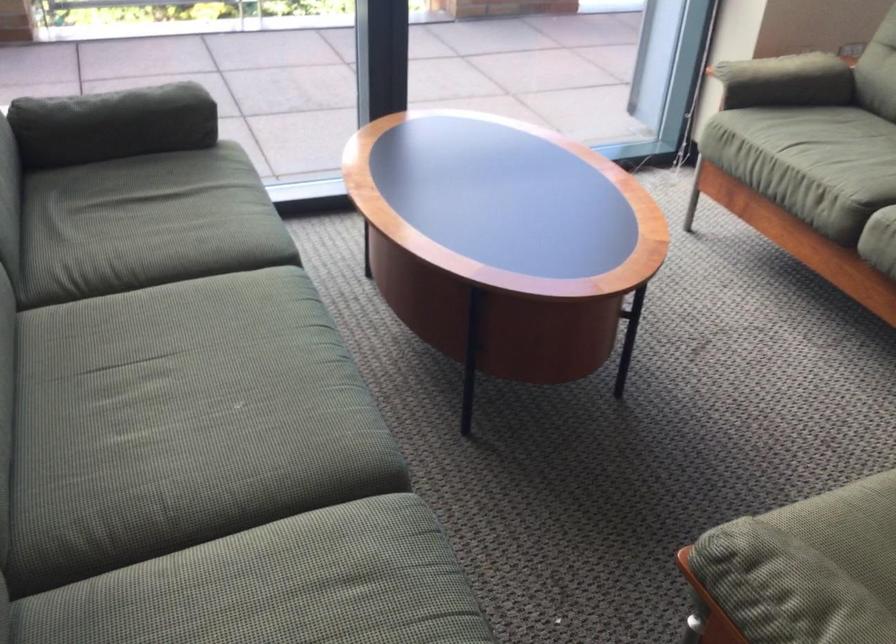
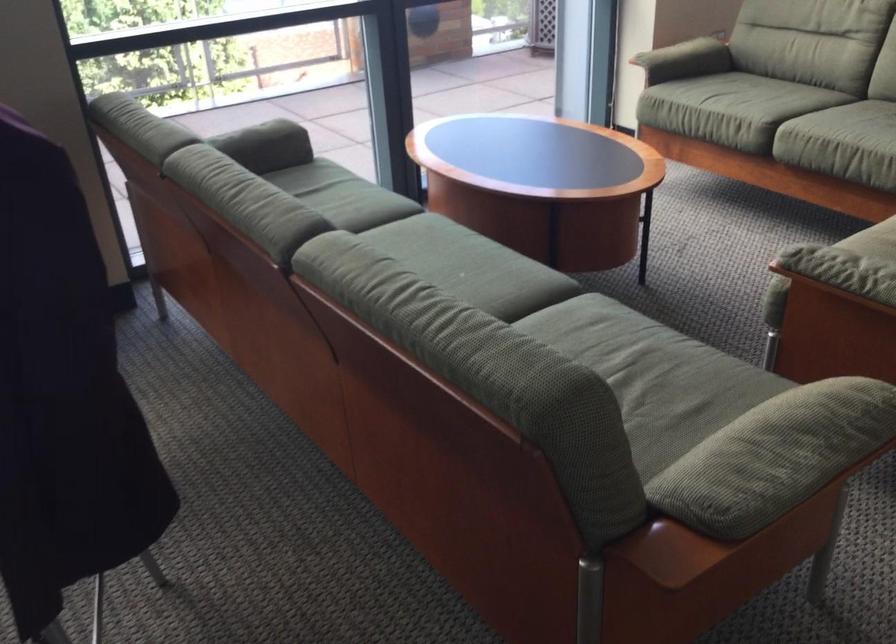
The point at (226, 383) is marked in the first image. Where is the corresponding point in the second image?

(442, 267)